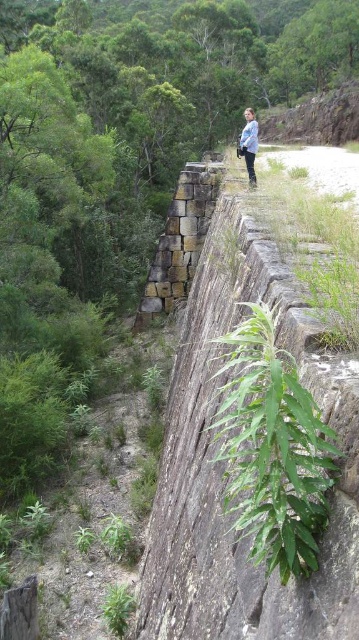
You are a hiker who has just arrived at the stone structure. You notice the brown rough stone at center and the blue denim jacket at upper center. Which object is smaller in size?

The brown rough stone at center is smaller in size compared to the blue denim jacket at upper center.

Looking at this image, you are standing in front of the stone wall and notice two points marked on the wall. One is at coordinate point [243,477] and the other at point [207,195]. Which point is nearer to your current position?

Point [243,477] is closer to the camera than point [207,195], so the point at [243,477] is nearer to your current position.